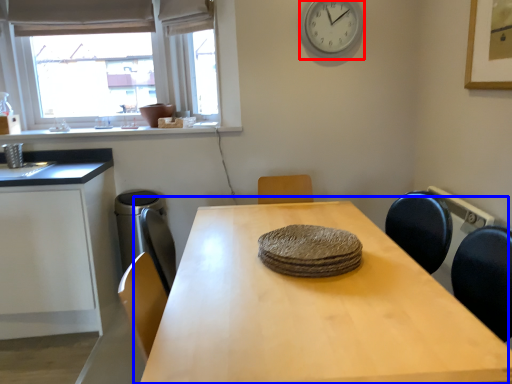
Question: Which object appears closest to the camera in this image, clock (highlighted by a red box) or table (highlighted by a blue box)?

Choices:
 (A) clock
 (B) table

Answer: (B)